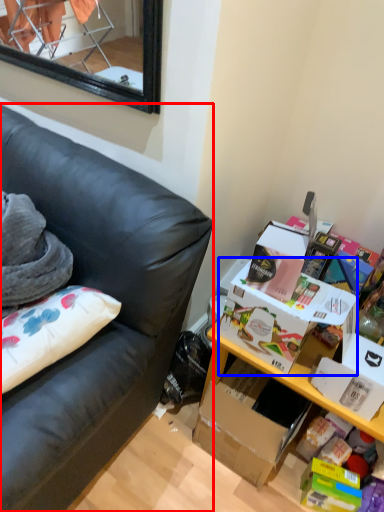
Question: Which object appears closest to the camera in this image, studio couch (highlighted by a red box) or storage box (highlighted by a blue box)?

Choices:
 (A) studio couch
 (B) storage box

Answer: (A)